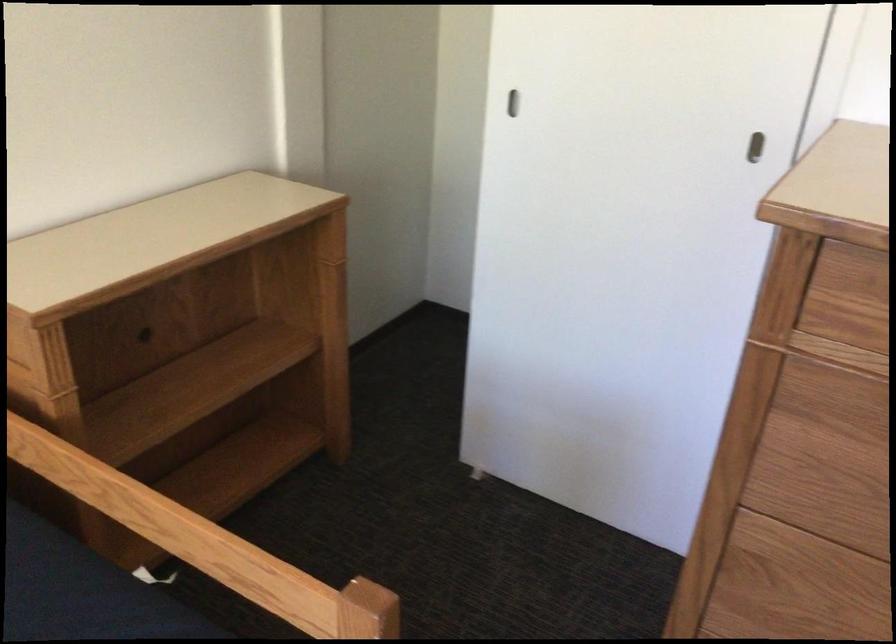
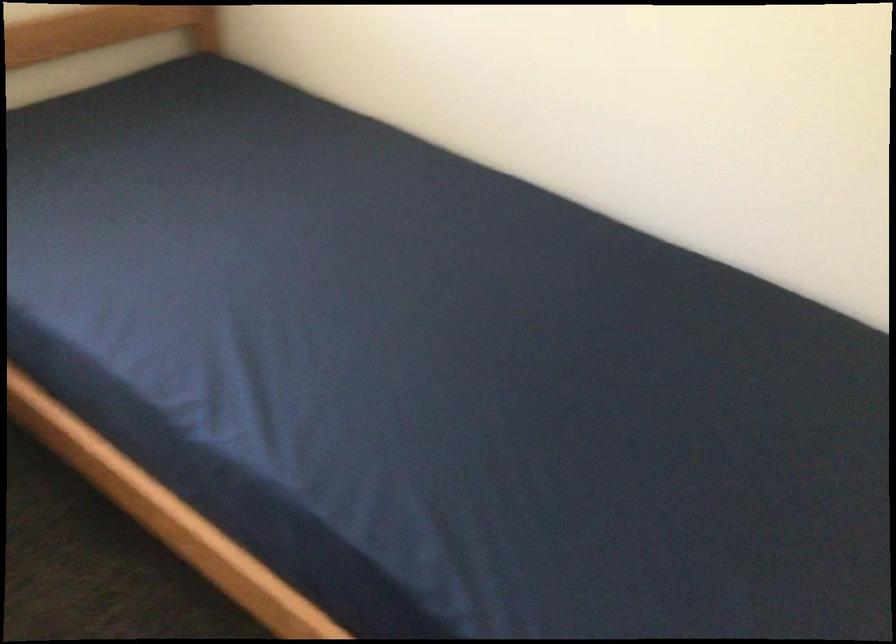
Looking at this image, the first image is from the beginning of the video and the second image is from the end. How did the camera likely rotate when shooting the video?

The camera's rotation is toward left-down.